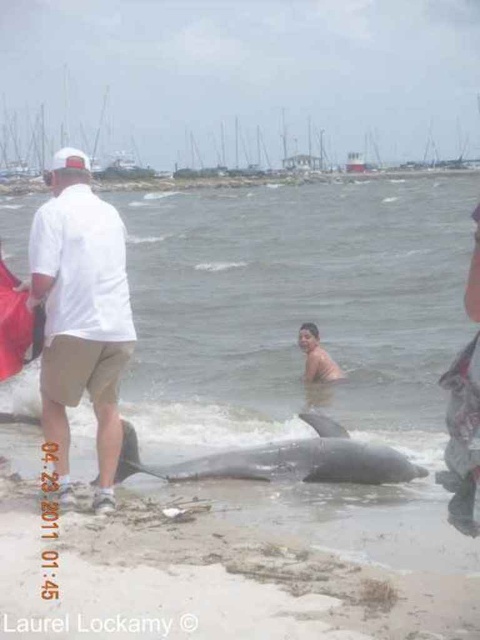
You are a wildlife photographer positioned at the camera location. You want to capture a closeup shot of the white matte shirt at left. Given that your telephoto lens has a minimum focusing distance of 5 meters, will you be able to take the photo?

The white matte shirt at left is 8.91 meters away from the camera. Since the minimum focusing distance of your telephoto lens is 5 meters, you can take the closeup shot because the subject is beyond the minimum required distance.

You are a photographer trying to capture both the white matte shirt at left and the tan skin human at center in a single frame. Based on their sizes in the image, which one would appear closer to the camera?

The white matte shirt at left appears larger in size than the tan skin human at center, so it is closer to the camera.

You are a marine biologist assessing the beach scene. You notice the gray matte whale at center and the tan skin human at center. Which object is positioned closer to your current viewpoint?

The gray matte whale at center is closer to the viewer than the tan skin human at center, so the whale is positioned closer to your viewpoint.